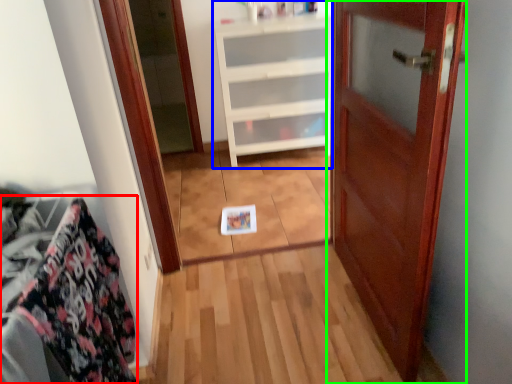
Question: Which object is the farthest from material (highlighted by a red box)? Choose among these: cabinetry (highlighted by a blue box) or door (highlighted by a green box).

Choices:
 (A) cabinetry
 (B) door

Answer: (A)